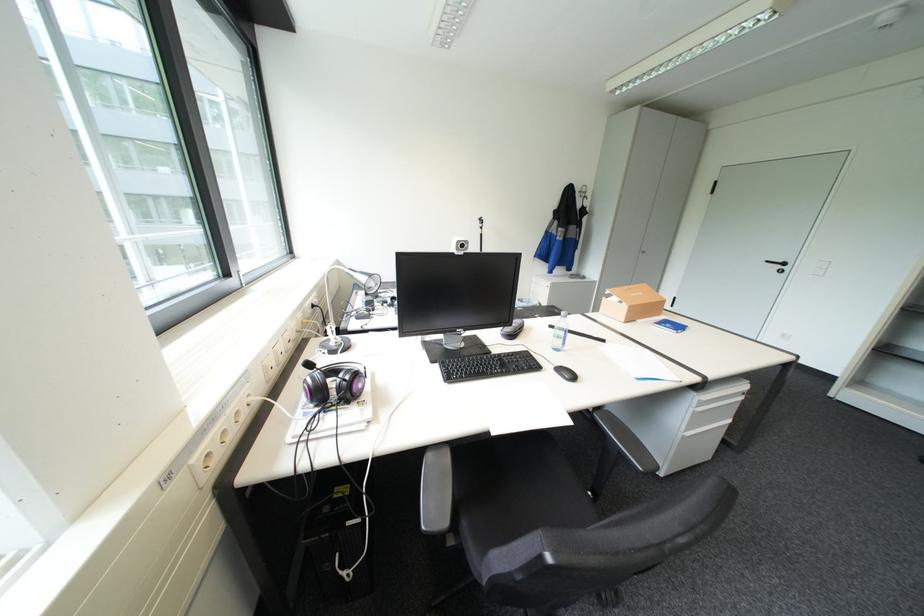
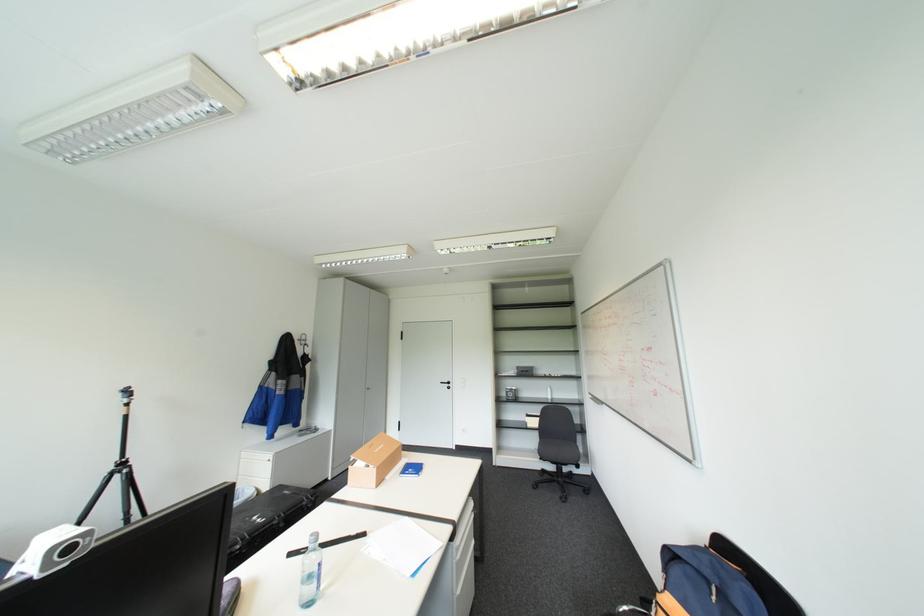
In the second image, find the point that corresponds to pixel 544 314 in the first image.

(262, 517)